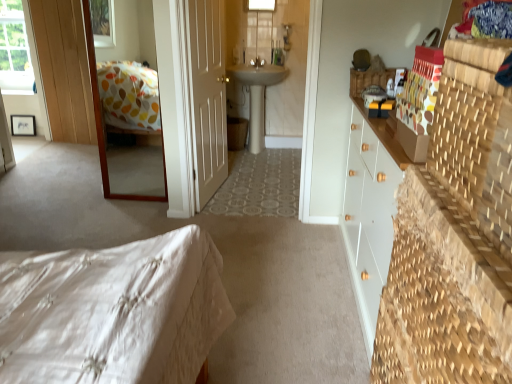
The image size is (512, 384). Find the location of `free space in front of white matte door at center`. free space in front of white matte door at center is located at coordinates (224, 210).